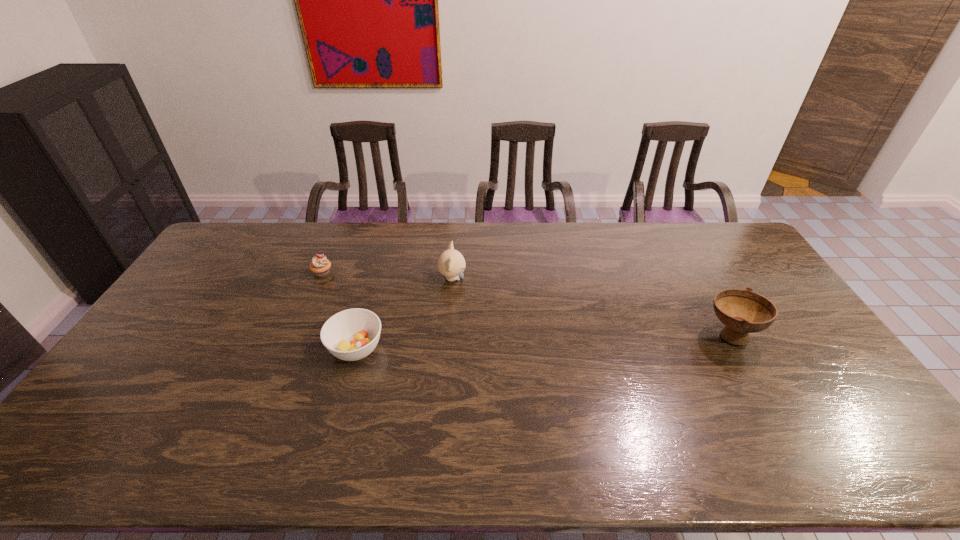
I want to click on the rightmost object, so click(742, 312).

You are a GUI agent. You are given a task and a screenshot of the screen. Output one action in this format:
    pyautogui.click(x=<x>, y=<y>)
    Task: Click on the right soup bowl
    The height and width of the screenshot is (540, 960).
    Given the screenshot: What is the action you would take?
    pyautogui.click(x=742, y=312)

You are a GUI agent. You are given a task and a screenshot of the screen. Output one action in this format:
    pyautogui.click(x=<x>, y=<y>)
    Task: Click on the third object from left to right
    
    Given the screenshot: What is the action you would take?
    pyautogui.click(x=451, y=263)

Locate an element on the screen. This screenshot has width=960, height=540. the leftmost object is located at coordinates (320, 265).

Where is `the third object from right to left`? The width and height of the screenshot is (960, 540). the third object from right to left is located at coordinates (350, 335).

This screenshot has height=540, width=960. Identify the location of the left soup bowl. (350, 335).

Find the location of a particular element. The width and height of the screenshot is (960, 540). free spot located on the right of the taller soup bowl is located at coordinates (783, 335).

Find the location of a particular element. This screenshot has width=960, height=540. vacant space situated on the face of the kitten is located at coordinates (487, 279).

Find the location of `vacant space positioned 0.230m on the front of the cupcake`. vacant space positioned 0.230m on the front of the cupcake is located at coordinates (299, 329).

Image resolution: width=960 pixels, height=540 pixels. Identify the location of free space located on the left of the left soup bowl. (290, 348).